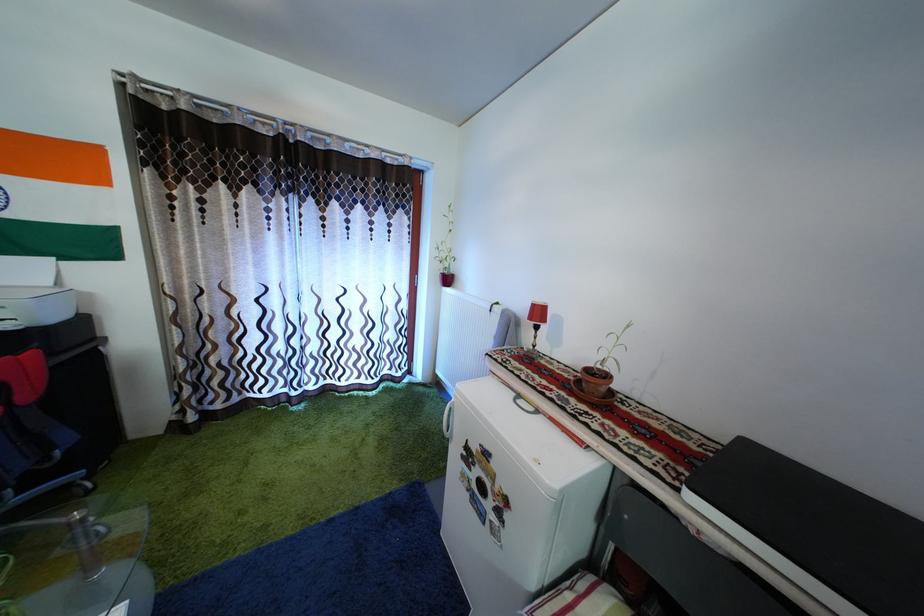
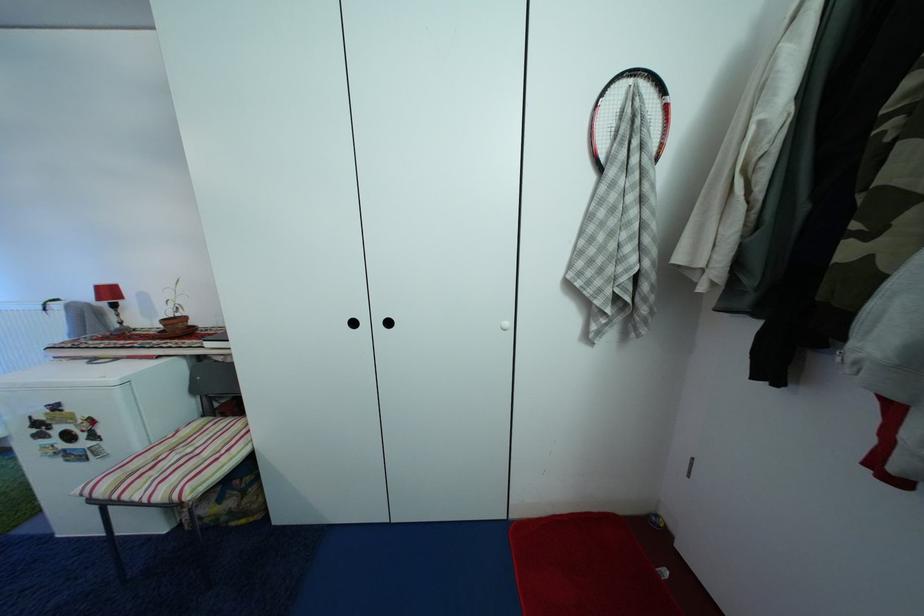
Locate, in the second image, the point that corresponds to the point at 541,313 in the first image.

(106, 294)